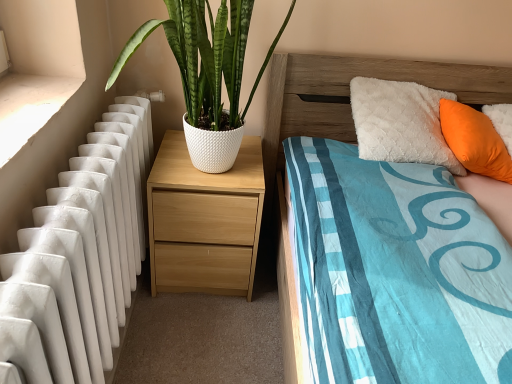
Question: Does wooden headboard at upper right have a greater height compared to light wood/texture nightstand at center?

Choices:
 (A) yes
 (B) no

Answer: (A)

Question: Does wooden headboard at upper right appear on the left side of light wood/texture nightstand at center?

Choices:
 (A) yes
 (B) no

Answer: (B)

Question: From a real-world perspective, is wooden headboard at upper right positioned over light wood/texture nightstand at center based on gravity?

Choices:
 (A) no
 (B) yes

Answer: (B)

Question: Is wooden headboard at upper right smaller than light wood/texture nightstand at center?

Choices:
 (A) no
 (B) yes

Answer: (A)

Question: From the image's perspective, is wooden headboard at upper right over light wood/texture nightstand at center?

Choices:
 (A) no
 (B) yes

Answer: (B)

Question: Is wooden headboard at upper right thinner than light wood/texture nightstand at center?

Choices:
 (A) no
 (B) yes

Answer: (B)

Question: Is white textured pot at left taller than wooden headboard at upper right?

Choices:
 (A) no
 (B) yes

Answer: (A)

Question: Does white textured pot at left appear on the left side of wooden headboard at upper right?

Choices:
 (A) yes
 (B) no

Answer: (A)

Question: Can you confirm if white textured pot at left is wider than wooden headboard at upper right?

Choices:
 (A) no
 (B) yes

Answer: (B)

Question: Is white textured pot at left further to the viewer compared to wooden headboard at upper right?

Choices:
 (A) yes
 (B) no

Answer: (B)

Question: Is white textured pot at left positioned with its back to wooden headboard at upper right?

Choices:
 (A) no
 (B) yes

Answer: (A)

Question: From the image's perspective, is white textured pot at left on wooden headboard at upper right?

Choices:
 (A) no
 (B) yes

Answer: (B)

Question: Could you tell me if light wood/texture nightstand at center is turned towards orange fabric pillow at upper right?

Choices:
 (A) yes
 (B) no

Answer: (B)